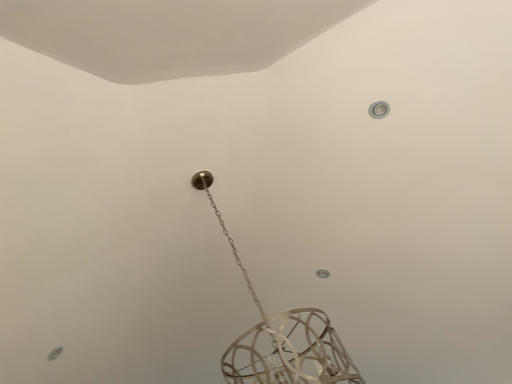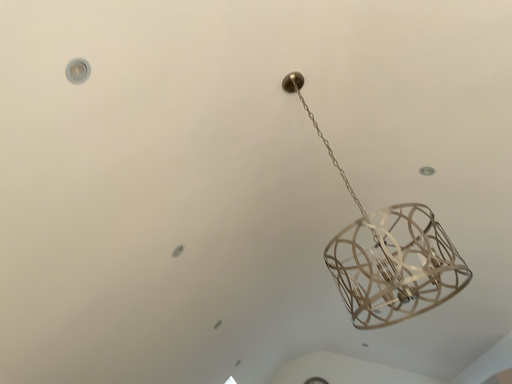
Question: How did the camera likely rotate when shooting the video?

Choices:
 (A) rotated left
 (B) rotated right

Answer: (A)